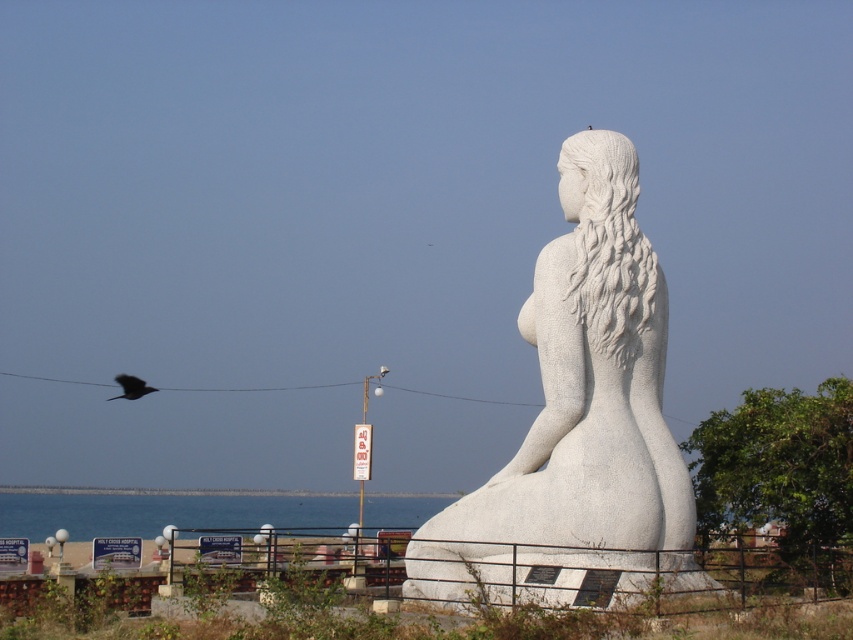
Which is in front, point (558, 472) or point (120, 387)?

Point (558, 472) is more forward.

Does white stone statue at center appear on the right side of dark feathered bird at upper left?

Indeed, white stone statue at center is positioned on the right side of dark feathered bird at upper left.

Where is `white stone statue at center`? white stone statue at center is located at coordinates (579, 422).

The width and height of the screenshot is (853, 640). I want to click on white stone statue at center, so click(x=579, y=422).